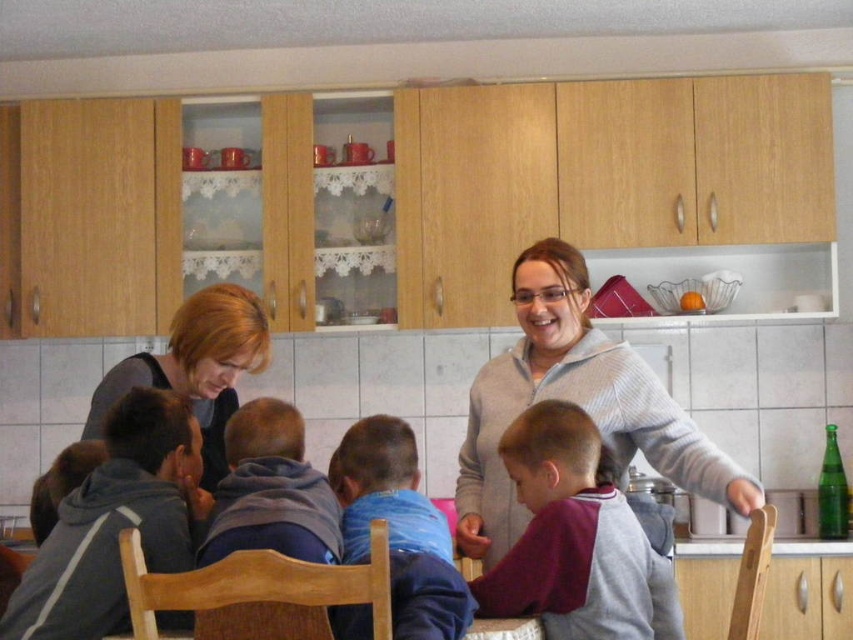
Question: Which point appears farthest from the camera in this image?

Choices:
 (A) (142, 364)
 (B) (550, 358)
 (C) (616, 524)
 (D) (422, 604)

Answer: (A)

Question: Is maroon fleece jacket at center to the right of blue fleece jacket at center from the viewer's perspective?

Choices:
 (A) yes
 (B) no

Answer: (A)

Question: Does gray striped sweater at upper center appear under blonde hair at left?

Choices:
 (A) no
 (B) yes

Answer: (B)

Question: Which point is farther to the camera?

Choices:
 (A) maroon fleece jacket at center
 (B) blue fleece jacket at center
 (C) gray striped sweater at upper center
 (D) blonde hair at left

Answer: (D)

Question: Is gray striped sweater at upper center positioned at the back of maroon fleece jacket at center?

Choices:
 (A) yes
 (B) no

Answer: (A)

Question: Which point is closer to the camera?

Choices:
 (A) (618, 452)
 (B) (354, 502)
 (C) (555, 621)

Answer: (C)